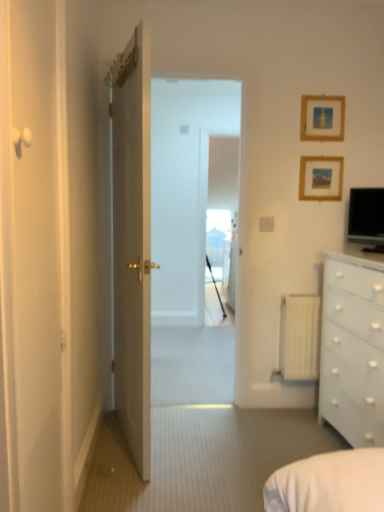
Question: From the image's perspective, is black glossy monitor at upper right beneath white glossy door at center, acting as the 1th door starting from the back?

Choices:
 (A) yes
 (B) no

Answer: (B)

Question: Does black glossy monitor at upper right have a lesser width compared to white glossy door at center, acting as the 1th door starting from the back?

Choices:
 (A) no
 (B) yes

Answer: (B)

Question: From the image's perspective, is black glossy monitor at upper right on top of white glossy door at center, acting as the 1th door starting from the back?

Choices:
 (A) yes
 (B) no

Answer: (A)

Question: Is black glossy monitor at upper right at the left side of white glossy door at center, placed as the second door when sorted from front to back?

Choices:
 (A) yes
 (B) no

Answer: (B)

Question: Is black glossy monitor at upper right in front of white glossy door at center, placed as the second door when sorted from front to back?

Choices:
 (A) no
 (B) yes

Answer: (A)

Question: Are black glossy monitor at upper right and white glossy door at center, acting as the 1th door starting from the back, located far from each other?

Choices:
 (A) no
 (B) yes

Answer: (B)

Question: From the image's perspective, would you say white glossy door at center, acting as the 1th door starting from the back, is shown under wooden picture frame at upper right, the 2th picture frame in the bottom-to-top sequence?

Choices:
 (A) yes
 (B) no

Answer: (A)

Question: Does white glossy door at center, acting as the 1th door starting from the back, appear on the left side of wooden picture frame at upper right, the 1th picture frame positioned from the top?

Choices:
 (A) yes
 (B) no

Answer: (A)

Question: Is white glossy door at center, acting as the 1th door starting from the back, to the right of wooden picture frame at upper right, the 2th picture frame in the bottom-to-top sequence, from the viewer's perspective?

Choices:
 (A) no
 (B) yes

Answer: (A)

Question: From a real-world perspective, is white glossy door at center, acting as the 1th door starting from the back, on wooden picture frame at upper right, the 1th picture frame positioned from the top?

Choices:
 (A) no
 (B) yes

Answer: (A)

Question: Does white glossy door at center, acting as the 1th door starting from the back, have a lesser height compared to wooden picture frame at upper right, the 2th picture frame in the bottom-to-top sequence?

Choices:
 (A) yes
 (B) no

Answer: (B)

Question: Can you confirm if white glossy door at center, placed as the second door when sorted from front to back, is smaller than wooden picture frame at upper right, the 1th picture frame positioned from the top?

Choices:
 (A) no
 (B) yes

Answer: (A)

Question: Is transparent glass window at center far away from black glossy monitor at upper right?

Choices:
 (A) yes
 (B) no

Answer: (A)